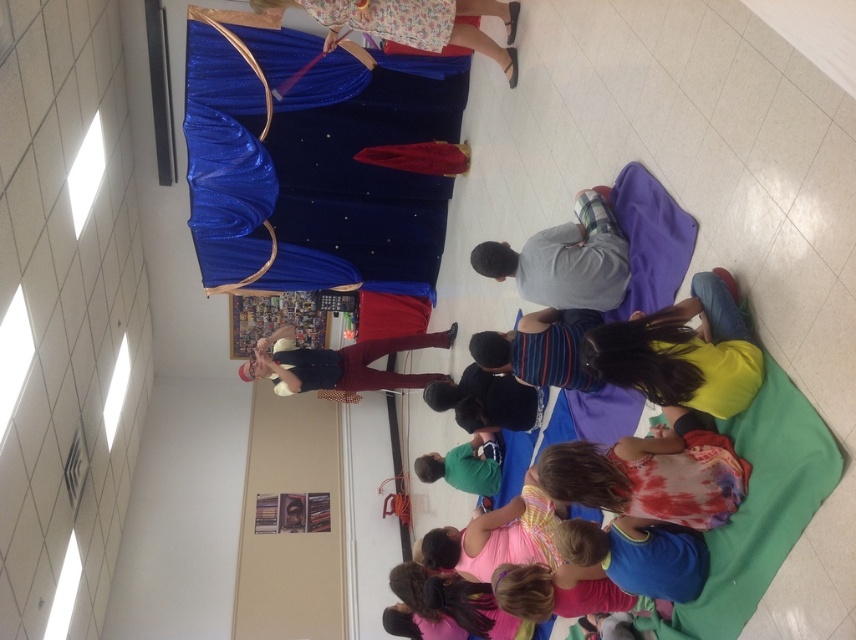
You are a teacher in a classroom and you need to locate two shirts. The yellow matte shirt at lower right and the green cotton shirt at lower center. Which shirt is positioned to the right side of the other?

The yellow matte shirt at lower right is to the right of green cotton shirt at lower center.

You are a photographer standing at the back of the room. You want to take a photo that includes both the striped cotton shirt at center and the green cotton shirt at lower center. Which shirt should you adjust to ensure both are in focus?

The striped cotton shirt at center is closer to the viewer than the green cotton shirt at lower center. To ensure both are in focus, you should move the striped cotton shirt at center slightly backward so it aligns with the distance of the green cotton shirt at lower center.